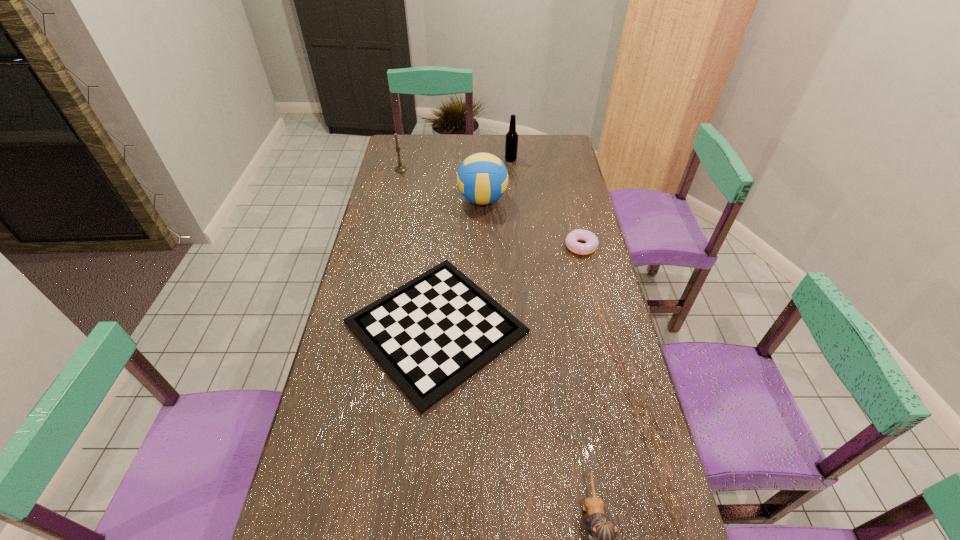
Find the location of a particular element. Image resolution: width=960 pixels, height=540 pixels. free space located 0.050m on the front of the candle is located at coordinates (398, 179).

You are a GUI agent. You are given a task and a screenshot of the screen. Output one action in this format:
    pyautogui.click(x=<x>, y=<y>)
    Task: Click on the vacant area situated 0.130m on the back of the rightmost object
    
    Given the screenshot: What is the action you would take?
    pyautogui.click(x=573, y=213)

This screenshot has height=540, width=960. What are the coordinates of `free space located 0.050m on the right of the fifth farthest object` in the screenshot? It's located at coord(546,328).

Locate an element on the screen. object that is at the far edge is located at coordinates (511, 143).

The width and height of the screenshot is (960, 540). I want to click on candle at the left edge, so click(400, 168).

Where is `checkerboard situated at the left edge`? This screenshot has width=960, height=540. checkerboard situated at the left edge is located at coordinates (430, 335).

This screenshot has height=540, width=960. I want to click on object situated at the right edge, so click(x=590, y=246).

In order to click on vacant space at the far edge of the desktop in this screenshot , I will do `click(429, 146)`.

The height and width of the screenshot is (540, 960). I want to click on vacant space at the left edge of the desktop, so click(x=367, y=469).

I want to click on vacant space at the right edge of the desktop, so click(x=586, y=351).